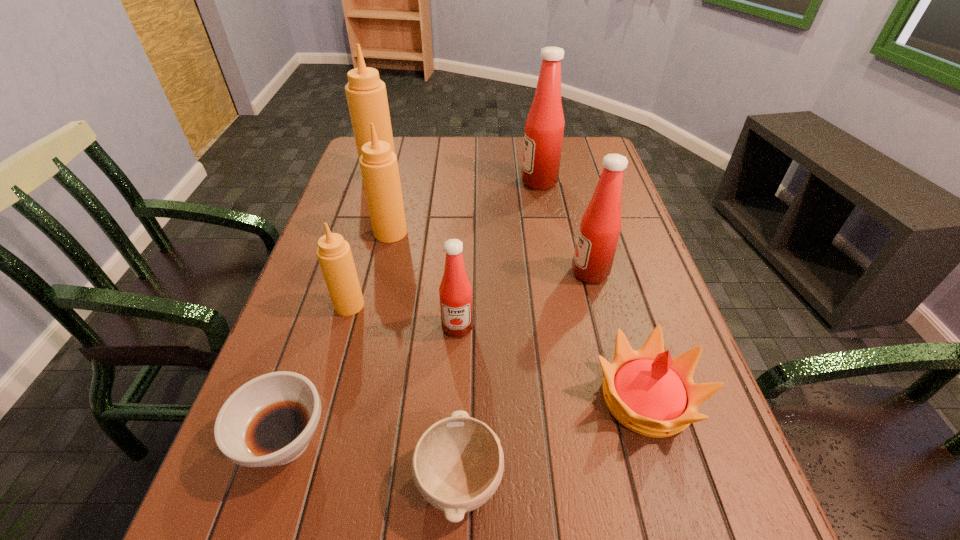
Find the location of a particular element. The image size is (960, 540). the seventh tallest object is located at coordinates (650, 393).

Identify the location of soup bowl. The image size is (960, 540). (269, 421).

Locate an element on the screen. The width and height of the screenshot is (960, 540). beige bowl is located at coordinates (458, 463).

At what (x,y) coordinates should I click in order to perform the action: click on vacant point located 0.070m on the front-facing side of the biggest red condiment. Please return your answer as a coordinate pair (x, y). Looking at the image, I should click on (498, 181).

Locate an element on the screen. The image size is (960, 540). vacant region located on the front-facing side of the biggest red condiment is located at coordinates (471, 181).

Where is `blank space located 0.330m on the front-facing side of the biggest red condiment`? blank space located 0.330m on the front-facing side of the biggest red condiment is located at coordinates (412, 181).

The height and width of the screenshot is (540, 960). I want to click on free space located on the back of the biggest tan condiment, so (x=388, y=150).

Where is `vacant space located on the front of the third farthest condiment`? vacant space located on the front of the third farthest condiment is located at coordinates (380, 275).

The width and height of the screenshot is (960, 540). What are the coordinates of `blank space located on the front-facing side of the fourth farthest object` in the screenshot? It's located at (525, 273).

You are a GUI agent. You are given a task and a screenshot of the screen. Output one action in this format:
    pyautogui.click(x=<x>, y=<y>)
    Task: Click on the vacant space located on the front-facing side of the fourth farthest object
    This screenshot has height=540, width=960.
    Given the screenshot: What is the action you would take?
    pyautogui.click(x=521, y=273)